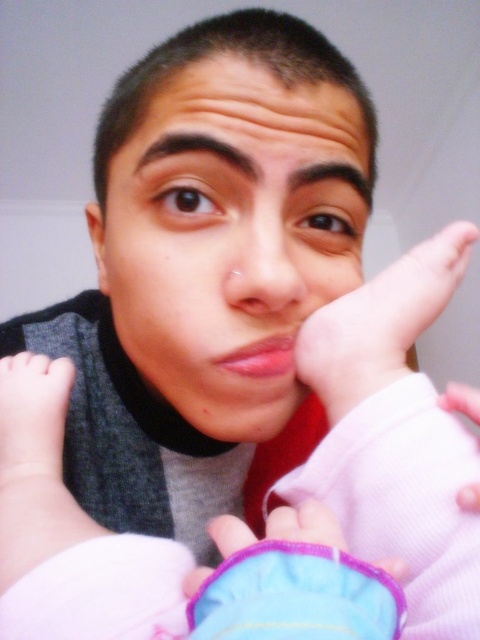
Looking at this image, you are a photographer trying to capture the baby arm in the image. The camera frame is set to focus on the area at point coordinates between 0.7 and 0.9 on the x and y axes. Is the white soft baby arm at lower left within the camera focus area?

The white soft baby arm at lower left is at point coordinates of 0.833 on the x and 0.146 on the y. Since the camera focus area is between 0.7 and 0.9 on both axes, the x coordinate is within the range, but the y coordinate of 0.146 is below the minimum of 0.7. Therefore, the white soft baby arm at lower left is not within the camera focus area.

You are a photographer setting up for a baby photoshoot. You have a pink fabric baby foot at center and a purple fabric glove at lower center in the scene. Which object should you focus on if you want to capture the smaller one in detail?

The pink fabric baby foot at center is smaller than the purple fabric glove at lower center, so you should focus on the pink fabric baby foot at center to capture the smaller one in detail.

You are a photographer adjusting the lighting for a portrait. The subject is holding a baby, and you notice the point at point (278, 220). You want to ensure that both the subject and the baby are well lit. How far apart are these two points?

The two points are 12.10 inches apart.